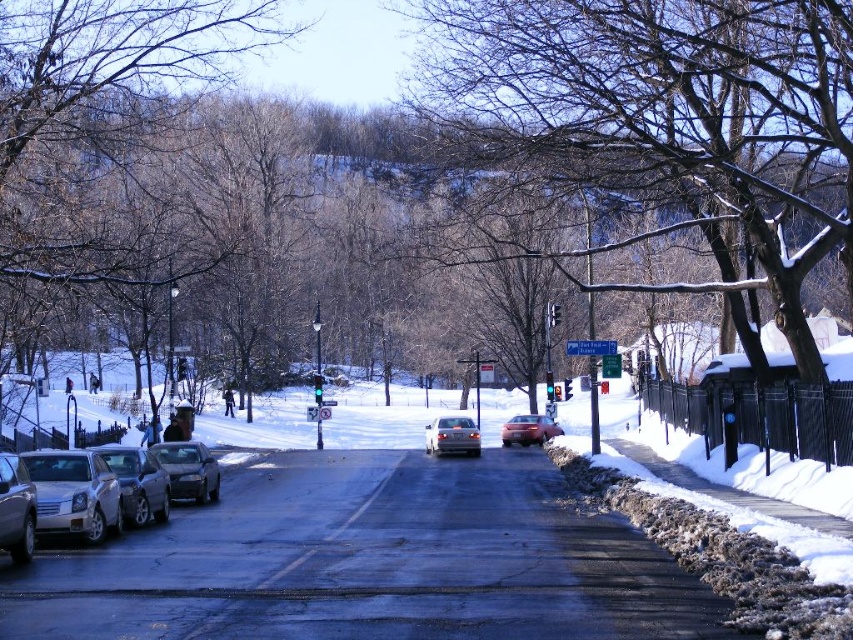
Is snow-covered branches at center below matte silver sedan at left?

Incorrect, snow-covered branches at center is not positioned below matte silver sedan at left.

Is the position of snow-covered branches at center less distant than that of matte silver sedan at left?

No, it is not.

The width and height of the screenshot is (853, 640). What are the coordinates of `snow-covered branches at center` in the screenshot? It's located at [x=664, y=129].

From the picture: Who is more distant from viewer, (773, 156) or (44, 461)?

Positioned behind is point (773, 156).

Between snow-covered branches at center and silver metallic sedan at left, which one has less height?

With less height is silver metallic sedan at left.

In order to click on snow-covered branches at center in this screenshot , I will do `click(664, 129)`.

Does matte silver sedan at left appear on the right side of satin silver sedan at center?

In fact, matte silver sedan at left is to the left of satin silver sedan at center.

Is point (9, 528) positioned behind point (450, 440)?

That is False.

Is point (9, 474) closer to viewer compared to point (460, 416)?

Yes, it is.

The width and height of the screenshot is (853, 640). Find the location of `matte silver sedan at left`. matte silver sedan at left is located at coordinates (16, 508).